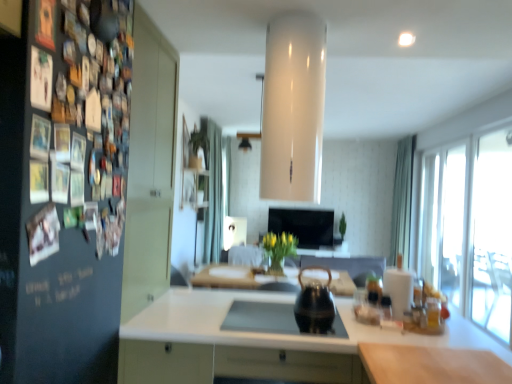
Question: Considering the positions of transparent glass door at right, the second glass door from the back, and green fabric curtain at right, the first curtain in the right-to-left sequence, in the image, is transparent glass door at right, the second glass door from the back, wider or thinner than green fabric curtain at right, the first curtain in the right-to-left sequence,?

Choices:
 (A) thin
 (B) wide

Answer: (A)

Question: From a real-world perspective, is transparent glass door at right, the second glass door from the back, above or below green fabric curtain at right, the first curtain in the right-to-left sequence?

Choices:
 (A) below
 (B) above

Answer: (A)

Question: Which object is positioned farthest from the green matte plant at center?

Choices:
 (A) translucent glass vase at center
 (B) matte black tea pot at center
 (C) transparent glass door at right, arranged as the first glass door when viewed from the front
 (D) yellow matte vase at center
 (E) black glass sink at center

Answer: (E)

Question: Which object is the farthest from the black glossy tv at center?

Choices:
 (A) white glossy countertop at center, positioned as the second countertop in front-to-back order
 (B) transparent glass door at right, the second glass door from the back
 (C) green matte plant at center
 (D) dark matte board at left
 (E) black glass sink at center

Answer: (D)